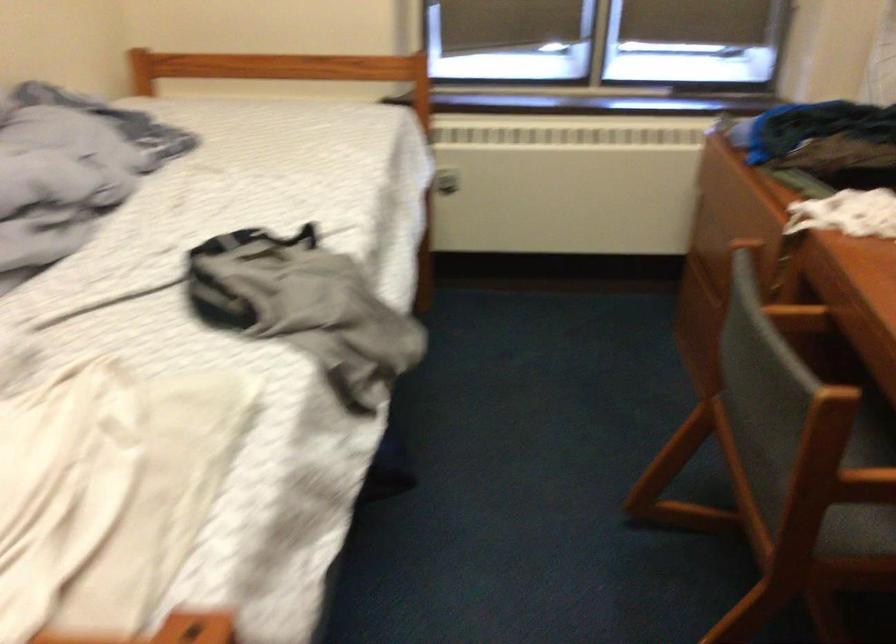
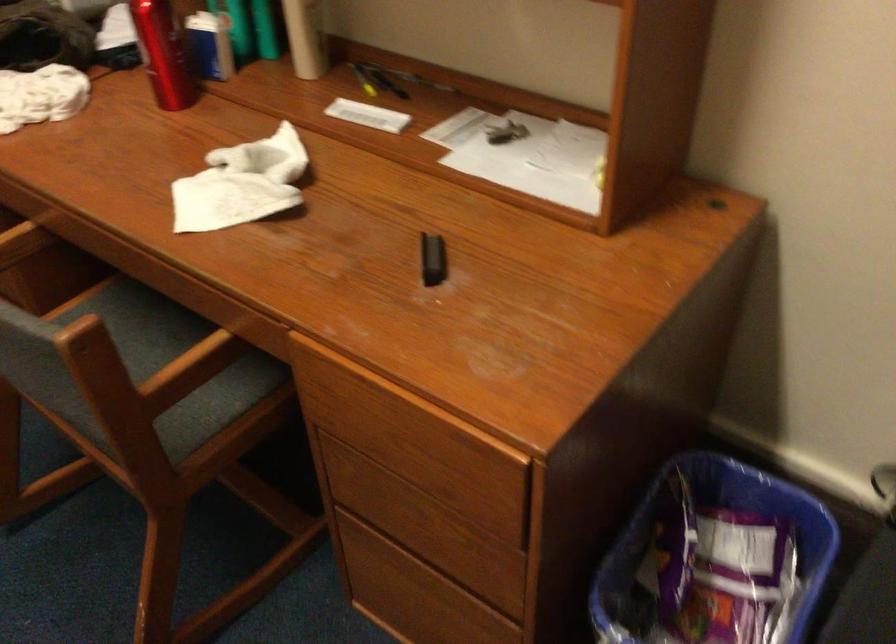
The first image is from the beginning of the video and the second image is from the end. How did the camera likely rotate when shooting the video?

The camera's rotation is toward right-down.